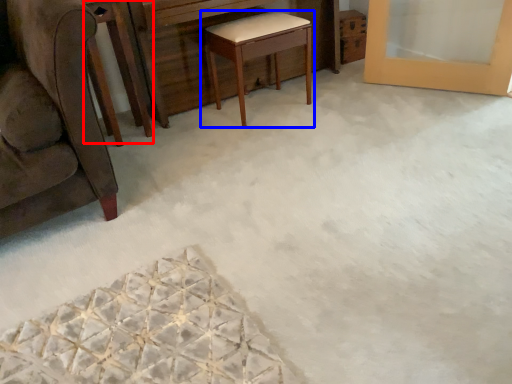
Question: Among these objects, which one is farthest to the camera, round table (highlighted by a red box) or table (highlighted by a blue box)?

Choices:
 (A) round table
 (B) table

Answer: (B)